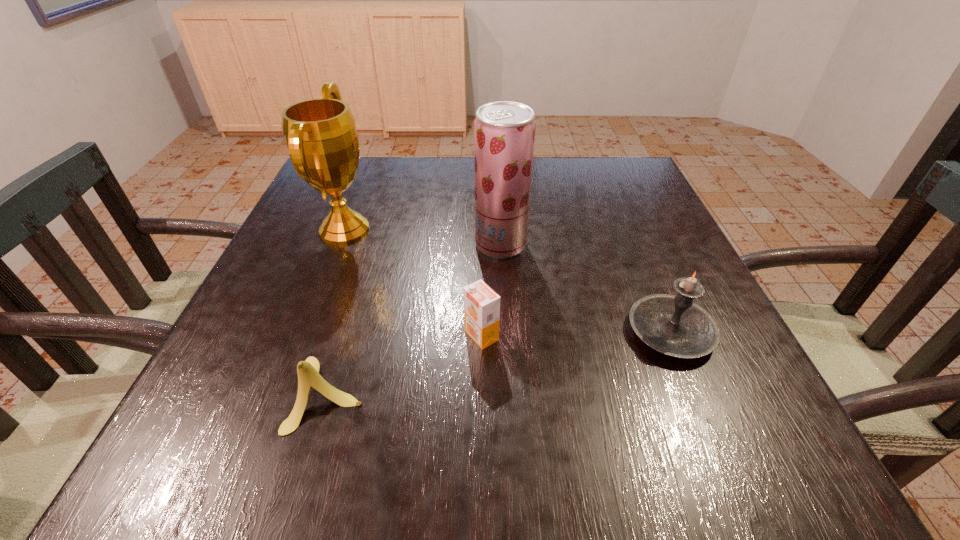
At what (x,y) coordinates should I click in order to perform the action: click on free space that is in between the banana and the third shortest object. Please return your answer as a coordinate pair (x, y). Looking at the image, I should click on (499, 363).

Identify the location of free space between the fruit juice and the banana. Image resolution: width=960 pixels, height=540 pixels. (415, 319).

At what (x,y) coordinates should I click in order to perform the action: click on free point between the award and the candle. Please return your answer as a coordinate pair (x, y). Looking at the image, I should click on (508, 281).

Locate an element on the screen. unoccupied position between the award and the candle is located at coordinates pyautogui.click(x=508, y=281).

What are the coordinates of `vacant point located between the candle and the banana` in the screenshot? It's located at (499, 363).

Identify the location of object that stands as the closest to the orange juice. (308, 371).

Select which object appears as the fourth closest to the award. Please provide its 2D coordinates. Your answer should be formatted as a tuple, i.e. [(x, y)], where the tuple contains the x and y coordinates of a point satisfying the conditions above.

[(674, 325)]

You are a GUI agent. You are given a task and a screenshot of the screen. Output one action in this format:
    pyautogui.click(x=<x>, y=<y>)
    Task: Click on the free space in the image that satisfies the following two spatial constraints: 1. on the back side of the candle; 2. on the left side of the banana
    
    Given the screenshot: What is the action you would take?
    pyautogui.click(x=347, y=332)

Identify the location of free region that satisfies the following two spatial constraints: 1. on the back side of the banana; 2. on the left side of the orange juice. Image resolution: width=960 pixels, height=540 pixels. (346, 335).

This screenshot has height=540, width=960. Identify the location of vacant region that satisfies the following two spatial constraints: 1. on the front-facing side of the rightmost object; 2. on the right side of the award. (305, 332).